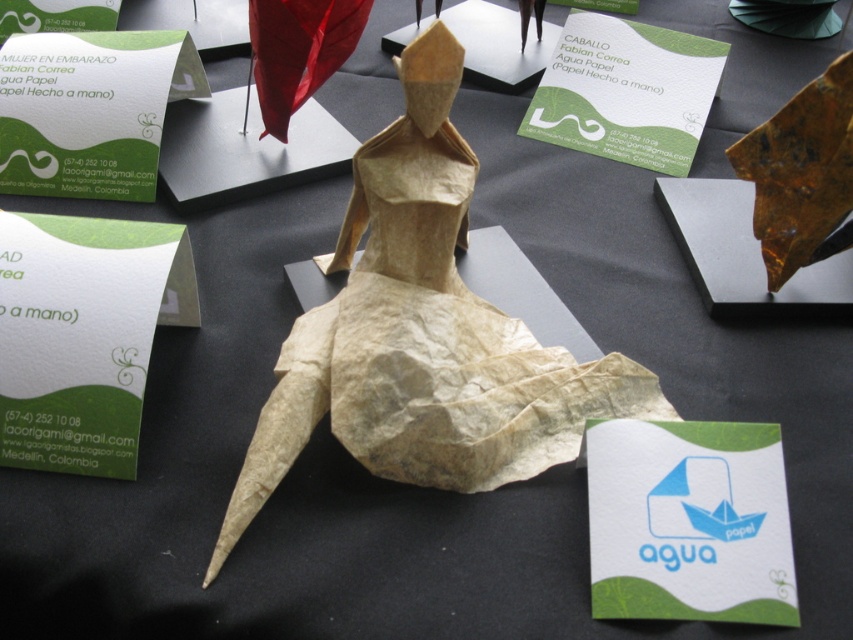
Question: Among these points, which one is farthest from the camera?

Choices:
 (A) (59, 99)
 (B) (0, 285)
 (C) (590, 525)
 (D) (625, 96)

Answer: (D)

Question: Does white paper at upper left have a larger size compared to white paper boat at center?

Choices:
 (A) no
 (B) yes

Answer: (B)

Question: From the image, what is the correct spatial relationship of white paper at upper left in relation to white paper boat at center?

Choices:
 (A) above
 (B) below

Answer: (A)

Question: Which point appears closest to the camera in this image?

Choices:
 (A) (167, 40)
 (B) (39, 384)

Answer: (B)

Question: Is white paper at upper left smaller than green paper at upper center?

Choices:
 (A) no
 (B) yes

Answer: (B)

Question: Which point is closer to the camera?

Choices:
 (A) white paper at upper left
 (B) green paper business card at upper left
 (C) green paper at upper center

Answer: (A)